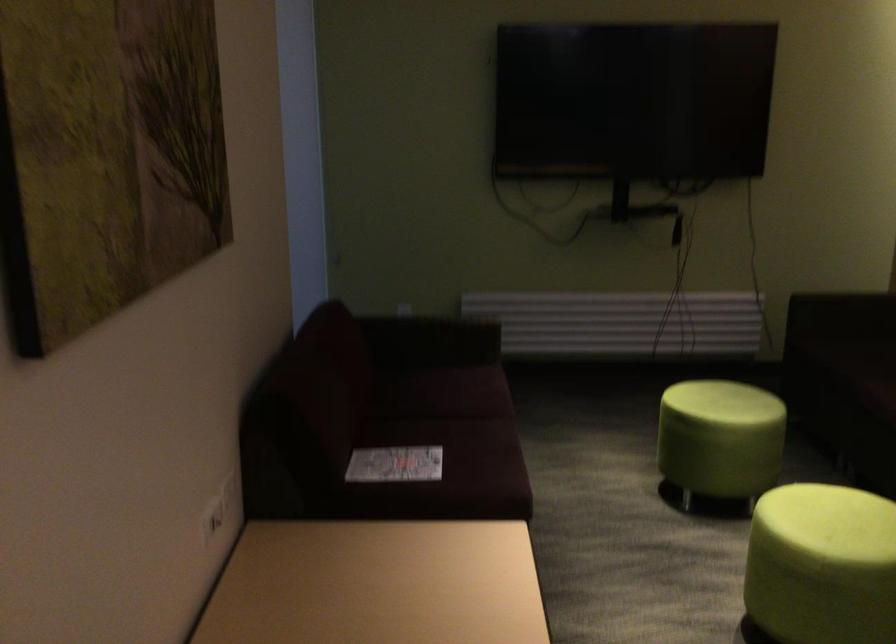
This screenshot has width=896, height=644. I want to click on sofa sitting surface, so click(426, 371).